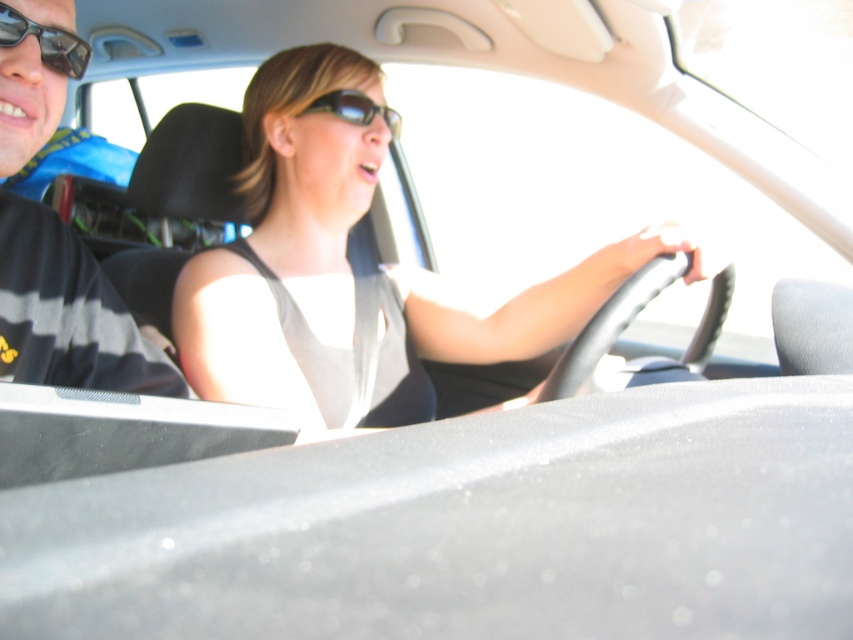
Question: Which point is closer to the camera?

Choices:
 (A) matte black sunglasses at upper left
 (B) white fabric tank top at center
 (C) sunglasses at center

Answer: (A)

Question: Among these objects, which one is farthest from the camera?

Choices:
 (A) white fabric tank top at center
 (B) matte black sunglasses at upper left

Answer: (A)

Question: Does black striped shirt at left have a greater width compared to sunglasses at center?

Choices:
 (A) yes
 (B) no

Answer: (A)

Question: Is matte black sunglasses at upper left further to the viewer compared to sunglasses at center?

Choices:
 (A) no
 (B) yes

Answer: (A)

Question: Estimate the real-world distances between objects in this image. Which object is closer to the sunglasses at center?

Choices:
 (A) black striped shirt at left
 (B) matte black sunglasses at upper left
 (C) white fabric tank top at center

Answer: (C)

Question: Is white fabric tank top at center wider than sunglasses at center?

Choices:
 (A) yes
 (B) no

Answer: (A)